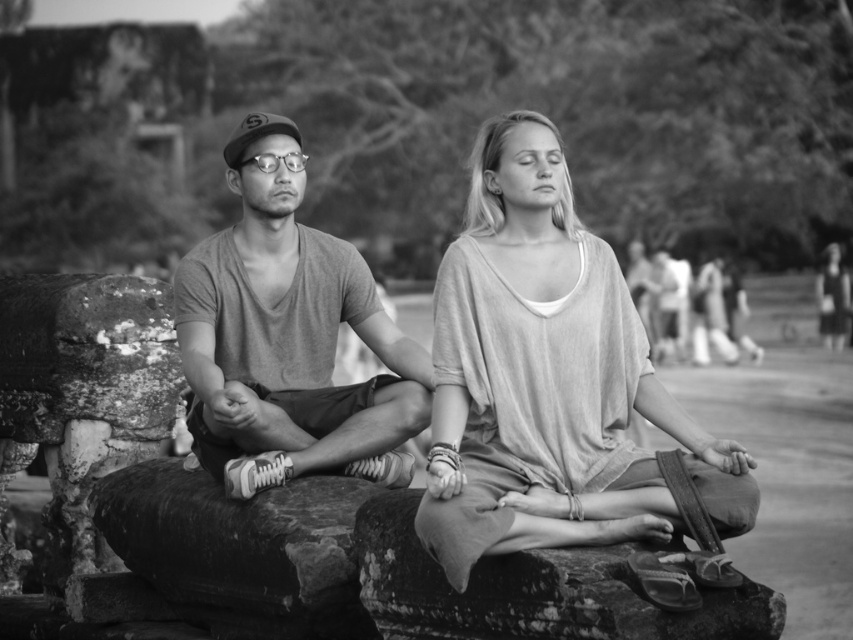
You are a photographer who wants to ensure both the matte gray shirt at center and the smooth stone at center are clearly visible in your next photo. Given their sizes, which object should you focus on to capture both effectively?

The matte gray shirt at center is larger than the smooth stone at center, so focusing on the matte gray shirt at center would help ensure both are in focus since it is the larger object.